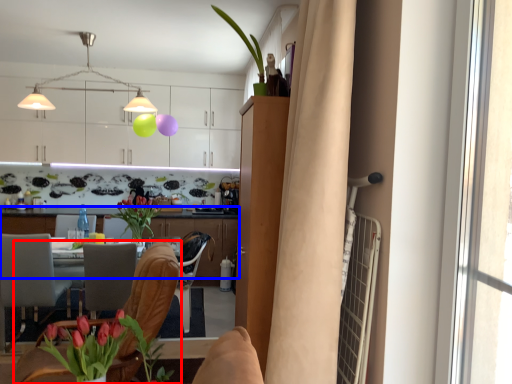
Question: Which point is further to the camera, chair (highlighted by a red box) or cabinetry (highlighted by a blue box)?

Choices:
 (A) chair
 (B) cabinetry

Answer: (B)